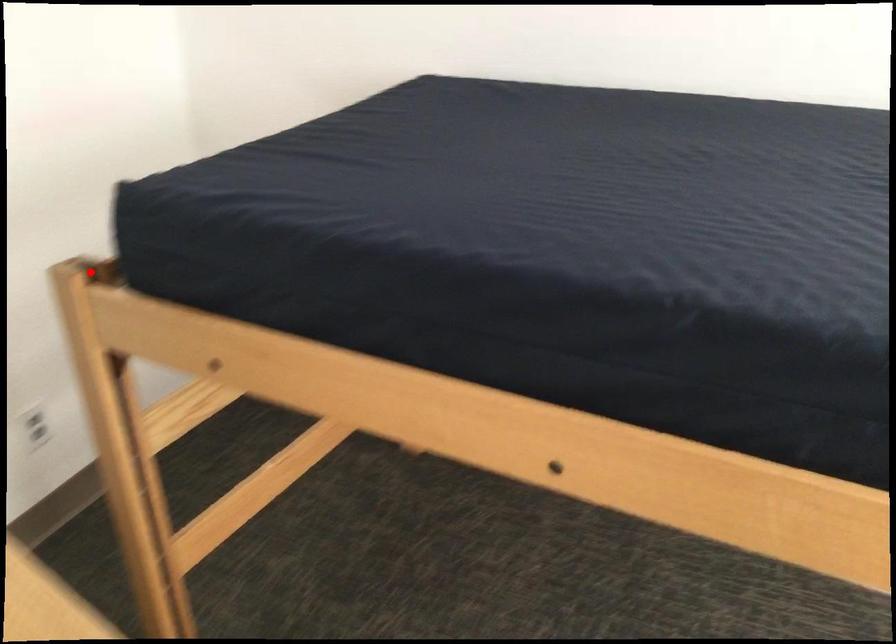
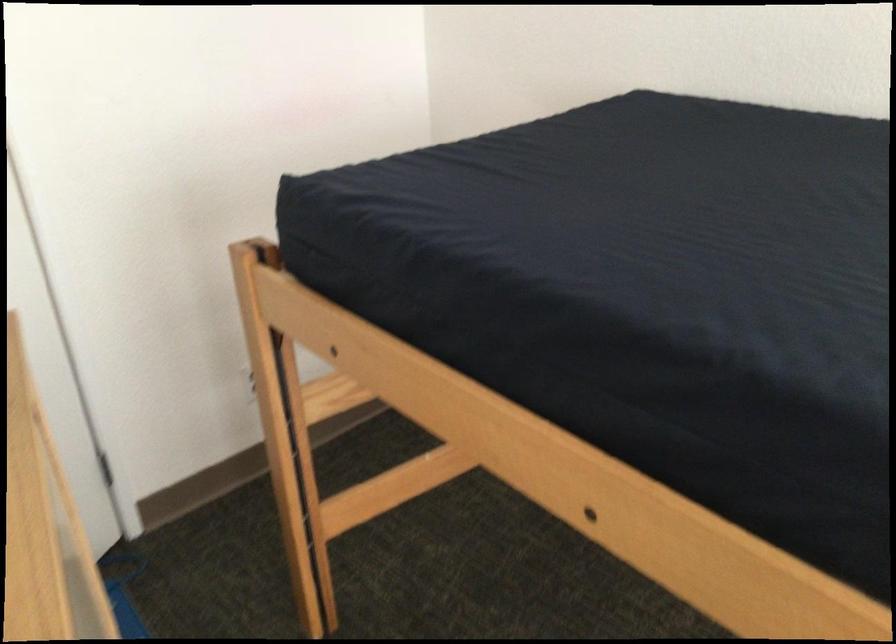
Question: I am providing you with two images of the same scene from different viewpoints. Image1 has a red point marked. In image2, the corresponding 3D location appears at what relative position? Reply with the corresponding letter.

Choices:
 (A) Closer
 (B) Farther

Answer: (B)